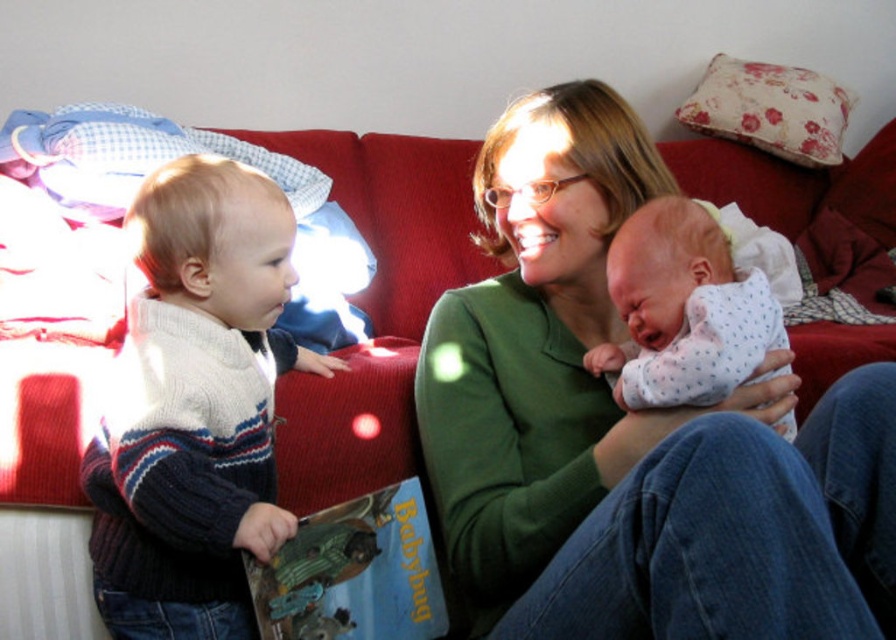
How far apart are green soft sweater at center and knitted sweater at left?

green soft sweater at center and knitted sweater at left are 13.93 inches apart.

Is green soft sweater at center to the left of knitted sweater at left from the viewer's perspective?

Incorrect, green soft sweater at center is not on the left side of knitted sweater at left.

Where is `green soft sweater at center`? green soft sweater at center is located at coordinates (630, 433).

The height and width of the screenshot is (640, 896). I want to click on green soft sweater at center, so click(x=630, y=433).

Can you confirm if white dotted fabric at center is taller than hardcover book at lower left?

Yes, white dotted fabric at center is taller than hardcover book at lower left.

Can you confirm if white dotted fabric at center is positioned above hardcover book at lower left?

Yes, white dotted fabric at center is above hardcover book at lower left.

Identify the location of white dotted fabric at center. This screenshot has width=896, height=640. (683, 310).

Describe the element at coordinates (195, 406) in the screenshot. The height and width of the screenshot is (640, 896). I see `knitted sweater at left` at that location.

Can you confirm if knitted sweater at left is wider than hardcover book at lower left?

Correct, the width of knitted sweater at left exceeds that of hardcover book at lower left.

Is point (143, 346) closer to camera compared to point (339, 598)?

Yes, point (143, 346) is closer to viewer.

The width and height of the screenshot is (896, 640). Find the location of `knitted sweater at left`. knitted sweater at left is located at coordinates (195, 406).